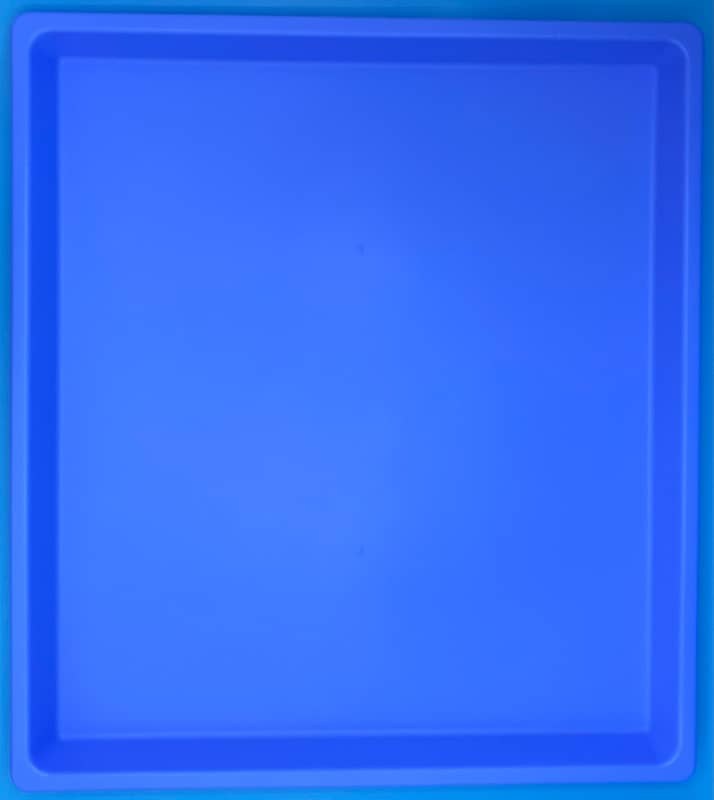
The width and height of the screenshot is (714, 800). I want to click on inner tray walls, so click(x=43, y=385), click(x=346, y=49), click(x=673, y=358), click(x=473, y=760).